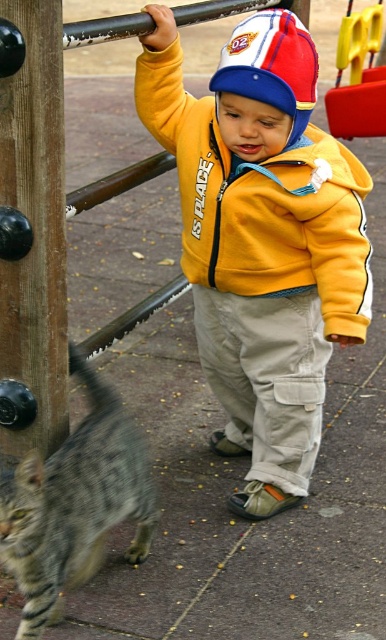
You are a photographer trying to capture a photo of the yellow fleece jacket at center and the gray striped fur at lower left. Which object should you focus on first if you want to ensure both are in the frame without moving the camera?

The yellow fleece jacket at center is larger in size than the gray striped fur at lower left, so you should focus on the yellow fleece jacket at center first to ensure it fits within the frame, then adjust to include the smaller gray striped fur at lower left.

You are a parent trying to locate your child who is wearing a yellow fleece jacket at center. You see the brown wooden pole at left in the playground. Is the pole between you and the child or behind the child?

The brown wooden pole at left is behind the yellow fleece jacket at center, so the pole is behind the child.

Looking at this image, you are a parent looking for your child in the playground. You see the yellow fleece jacket at center and the gray striped fur at lower left. Which object is taller?

The yellow fleece jacket at center is taller than the gray striped fur at lower left.